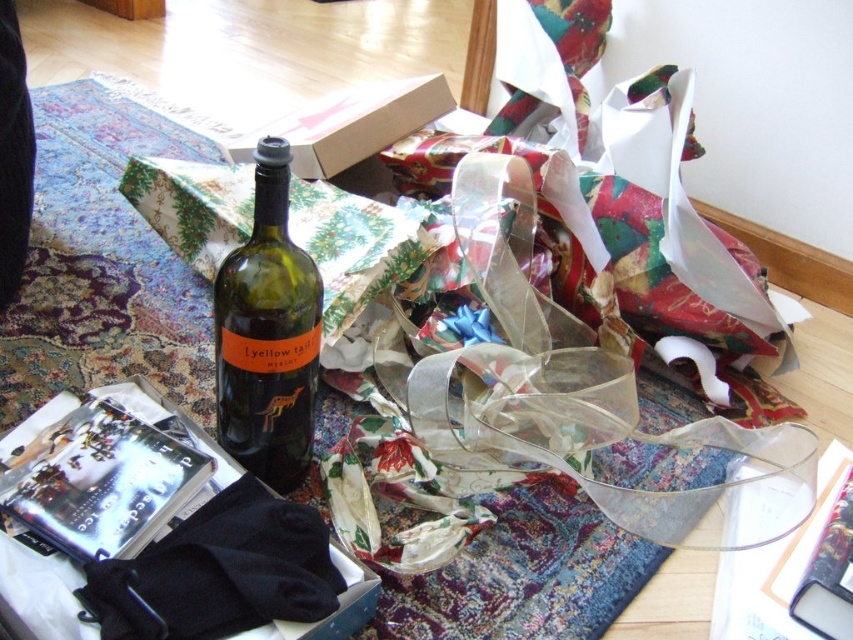
You are organizing a gift wrapping station and need to place the green glass bottle at center and the matte cardboard box at center on a shelf. The shelf has limited vertical space. Based on their positions in the image, which item should be placed first to ensure both fit vertically?

The green glass bottle at center is below the matte cardboard box at center in the image, so to fit both vertically on the shelf, place the matte cardboard box at center first, then the green glass bottle at center underneath it.

You are trying to locate the green glass bottle at center in the image. According to the coordinates provided, where exactly is it positioned?

The green glass bottle at center is positioned at point 0.525 on the x axis and 0.314 on the y axis.

You are standing in the room and want to pick up the green glass bottle at center. Based on the coordinates provided, can you confirm if it is located at point (267, 336)?

The green glass bottle at center is represented by point (267, 336), so yes, it is located at that coordinate.